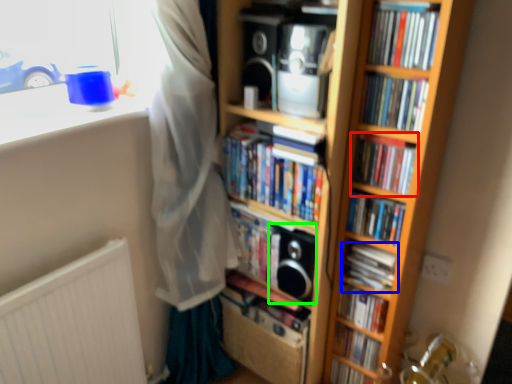
Question: Based on their relative distances, which object is farther from book (highlighted by a red box)? Choose from book (highlighted by a blue box) and speaker (highlighted by a green box).

Choices:
 (A) book
 (B) speaker

Answer: (B)